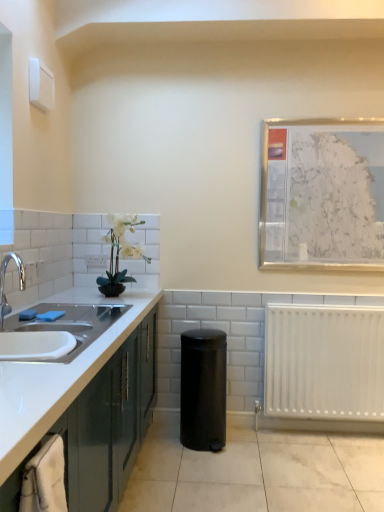
Describe the element at coordinates (54, 330) in the screenshot. I see `white ceramic sink at left` at that location.

What do you see at coordinates (119, 255) in the screenshot? This screenshot has height=512, width=384. I see `white matte plant at upper left` at bounding box center [119, 255].

What do you see at coordinates (96, 261) in the screenshot? I see `white plastic electric outlet at upper left` at bounding box center [96, 261].

Consider the image. In order to face white plastic radiator at lower right, should I rotate leftwards or rightwards?

You should look right and rotate roughly 17.762 degrees.

The image size is (384, 512). What do you see at coordinates (102, 428) in the screenshot?
I see `matte green cabinetry at left` at bounding box center [102, 428].

Identify the location of white ceramic sink at left. This screenshot has height=512, width=384. (54, 330).

Is white plastic radiator at lower right outside of matte green cabinetry at left?

Yes.

Which is closer, (345, 348) or (19, 498)?

Clearly, point (345, 348) is more distant from the camera than point (19, 498).

Is white plastic radiator at lower right with matte green cabinetry at left?

No, white plastic radiator at lower right is not making contact with matte green cabinetry at left.

Looking at this image, is white plastic radiator at lower right wider than matte green cabinetry at left?

No, white plastic radiator at lower right is not wider than matte green cabinetry at left.

From a real-world perspective, does white ceramic sink at left sit lower than black matte trash can at center?

No.

Is white ceramic sink at left closer to the viewer compared to black matte trash can at center?

Yes, it is.

Is white ceramic sink at left facing away from black matte trash can at center?

No, white ceramic sink at left's orientation is not away from black matte trash can at center.

Is black matte trash can at center positioned far away from white plastic radiator at lower right?

No, black matte trash can at center is not far away from white plastic radiator at lower right.

From a real-world perspective, is black matte trash can at center positioned over white plastic radiator at lower right based on gravity?

No.

Consider the image. Is black matte trash can at center located outside white plastic radiator at lower right?

Indeed, black matte trash can at center is completely outside white plastic radiator at lower right.

Considering the sizes of objects black matte trash can at center and white plastic radiator at lower right in the image provided, who is taller, black matte trash can at center or white plastic radiator at lower right?

white plastic radiator at lower right.

Is white plastic electric outlet at upper left looking in the opposite direction of black matte trash can at center?

No, white plastic electric outlet at upper left's orientation is not away from black matte trash can at center.

Between white plastic electric outlet at upper left and black matte trash can at center, which one has larger width?

black matte trash can at center is wider.

Choose the correct answer: Is white plastic electric outlet at upper left inside black matte trash can at center or outside it?

white plastic electric outlet at upper left lies outside black matte trash can at center.

Which object is positioned more to the right, white plastic electric outlet at upper left or white matte plant at upper left?

From the viewer's perspective, white matte plant at upper left appears more on the right side.

Is white plastic electric outlet at upper left positioned beyond the bounds of white matte plant at upper left?

Yes, white plastic electric outlet at upper left is located beyond the bounds of white matte plant at upper left.

Is white plastic electric outlet at upper left next to white matte plant at upper left?

They are not placed beside each other.

From the image's perspective, is white plastic radiator at lower right located above or below white ceramic sink at left?

Clearly, from the image's perspective, white plastic radiator at lower right is below white ceramic sink at left.

Between white plastic radiator at lower right and white ceramic sink at left, which one appears on the right side from the viewer's perspective?

Positioned to the right is white plastic radiator at lower right.

Is white plastic radiator at lower right beside white ceramic sink at left?

They are not placed beside each other.

How much distance is there between matte green cabinetry at left and white ceramic sink at left?

They are 13.86 inches apart.

Could you tell me if matte green cabinetry at left is facing white ceramic sink at left?

No, matte green cabinetry at left is not turned towards white ceramic sink at left.

Are matte green cabinetry at left and white ceramic sink at left far apart?

That's not correct — matte green cabinetry at left is a little close to white ceramic sink at left.

Which is in front, matte green cabinetry at left or white ceramic sink at left?

Positioned in front is matte green cabinetry at left.

I want to click on radiator lying behind the matte green cabinetry at left, so click(324, 367).

There is a black matte trash can at center. At what (x,y) coordinates should I click in order to perform the action: click on sink above it (from a real-world perspective). Please return your answer as a coordinate pair (x, y). Looking at the image, I should click on (54, 330).

Which object lies nearer to the anchor point white plastic radiator at lower right, white matte plant at upper left or metallic silver map at upper right?

metallic silver map at upper right is positioned closer to the anchor white plastic radiator at lower right.

Estimate the real-world distances between objects in this image. Which object is closer to black matte trash can at center, white plastic electric outlet at upper left or matte green cabinetry at left?

matte green cabinetry at left lies closer to black matte trash can at center than the other object.

Based on their spatial positions, is white plastic electric outlet at upper left or white ceramic sink at left further from white plastic radiator at lower right?

white plastic electric outlet at upper left lies further to white plastic radiator at lower right than the other object.

Which object lies further to the anchor point white ceramic sink at left, metallic silver map at upper right or matte green cabinetry at left?

Based on the image, metallic silver map at upper right appears to be further to white ceramic sink at left.

When comparing their distances from matte green cabinetry at left, does white plastic electric outlet at upper left or white plastic radiator at lower right seem closer?

The object closer to matte green cabinetry at left is white plastic electric outlet at upper left.

Which object lies nearer to the anchor point white ceramic sink at left, black matte trash can at center or white plastic radiator at lower right?

The object closer to white ceramic sink at left is black matte trash can at center.

From the picture: From the image, which object appears to be nearer to white plastic radiator at lower right, matte green cabinetry at left or white ceramic sink at left?

matte green cabinetry at left is closer to white plastic radiator at lower right.

Considering their positions, is matte green cabinetry at left positioned closer to metallic silver map at upper right than white plastic electric outlet at upper left?

Based on the image, matte green cabinetry at left appears to be nearer to metallic silver map at upper right.

The image size is (384, 512). I want to click on appliance situated between white matte plant at upper left and white plastic radiator at lower right from left to right, so click(203, 389).

At what (x,y) coordinates should I click in order to perform the action: click on sink between matte green cabinetry at left and metallic silver map at upper right in the front-back direction. Please return your answer as a coordinate pair (x, y). The height and width of the screenshot is (512, 384). Looking at the image, I should click on (54, 330).

Identify the location of picture frame between white ceramic sink at left and white plastic electric outlet at upper left along the z-axis. The image size is (384, 512). (322, 194).

Locate an element on the screen. The width and height of the screenshot is (384, 512). houseplant between white ceramic sink at left and white plastic radiator at lower right in the horizontal direction is located at coordinates (119, 255).